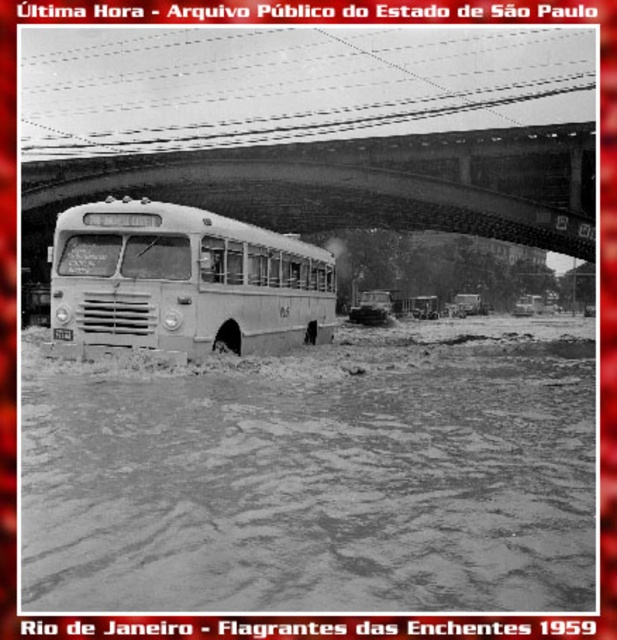
Does muddy water at lower center appear on the left side of smooth concrete bridge at center?

In fact, muddy water at lower center is to the right of smooth concrete bridge at center.

Based on the photo, can you confirm if muddy water at lower center is smaller than smooth concrete bridge at center?

Correct, muddy water at lower center occupies less space than smooth concrete bridge at center.

The height and width of the screenshot is (640, 617). Identify the location of muddy water at lower center. (317, 476).

This screenshot has height=640, width=617. In order to click on muddy water at lower center in this screenshot , I will do [317, 476].

Consider the image. Does muddy water at lower center lie in front of white matte school bus at center?

That is True.

Consider the image. Which is above, muddy water at lower center or white matte school bus at center?

Positioned higher is white matte school bus at center.

Measure the distance between point (497, 502) and camera.

Point (497, 502) and camera are 5.70 meters apart from each other.

Where is `muddy water at lower center`? Image resolution: width=617 pixels, height=640 pixels. muddy water at lower center is located at coordinates (317, 476).

Is the position of smooth concrete bridge at center more distant than that of white matte school bus at center?

Yes.

Can you confirm if smooth concrete bridge at center is bigger than white matte school bus at center?

Indeed, smooth concrete bridge at center has a larger size compared to white matte school bus at center.

This screenshot has width=617, height=640. Describe the element at coordinates (357, 184) in the screenshot. I see `smooth concrete bridge at center` at that location.

Find the location of a particular element. This screenshot has height=640, width=617. smooth concrete bridge at center is located at coordinates (357, 184).